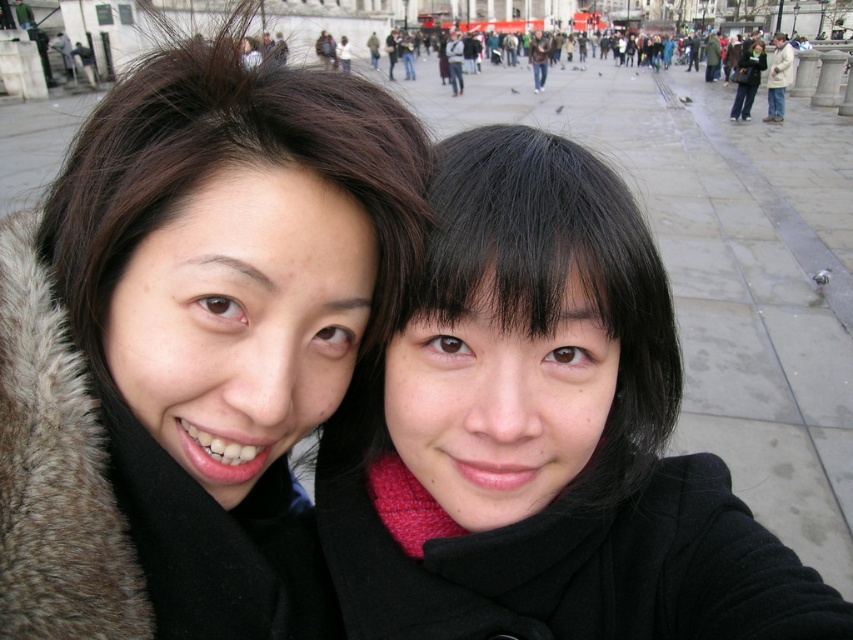
You are a photographer trying to capture a clear shot of both the black fur coat at upper left and the black matte coat at center. Since the two coats are positioned in a crowded area, you need to determine their relative positions to frame the shot properly. Which coat is positioned to the left of the other?

The black fur coat at upper left is to the left of the black matte coat at center.

You are standing at point (283,291) and want to take a selfie with two people who are 33.03 meters away. Can you capture both of them in your photo if your camera has a standard 50mm lens?

The two people are 33.03 meters away from your position at point (283,291). With a standard 50mm lens, the field of view is approximately 46 degrees, which should easily capture both individuals at that distance.